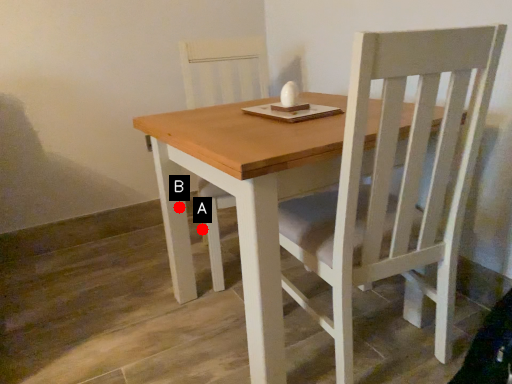
Question: Two points are circled on the image, labeled by A and B beside each circle. Which point is further to the camera?

Choices:
 (A) A is further
 (B) B is further

Answer: (A)